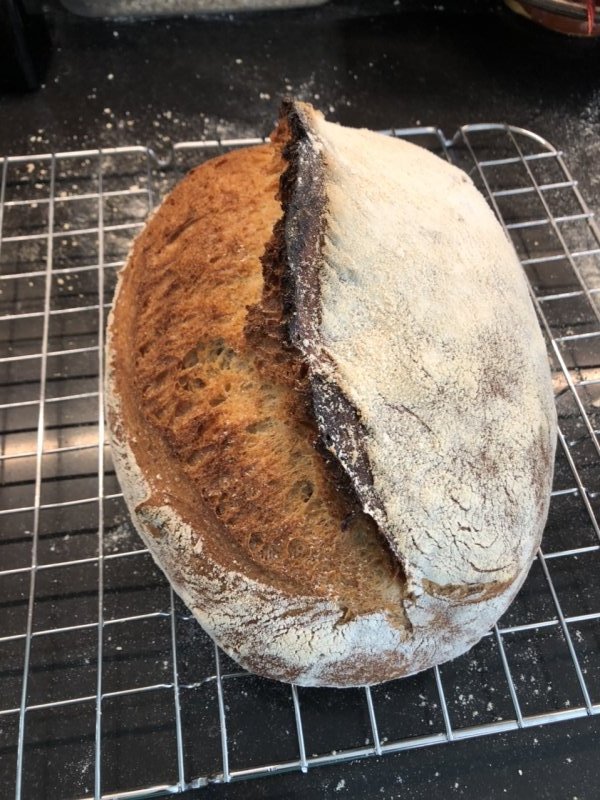
Identify the location of wire rack. (x=100, y=577).